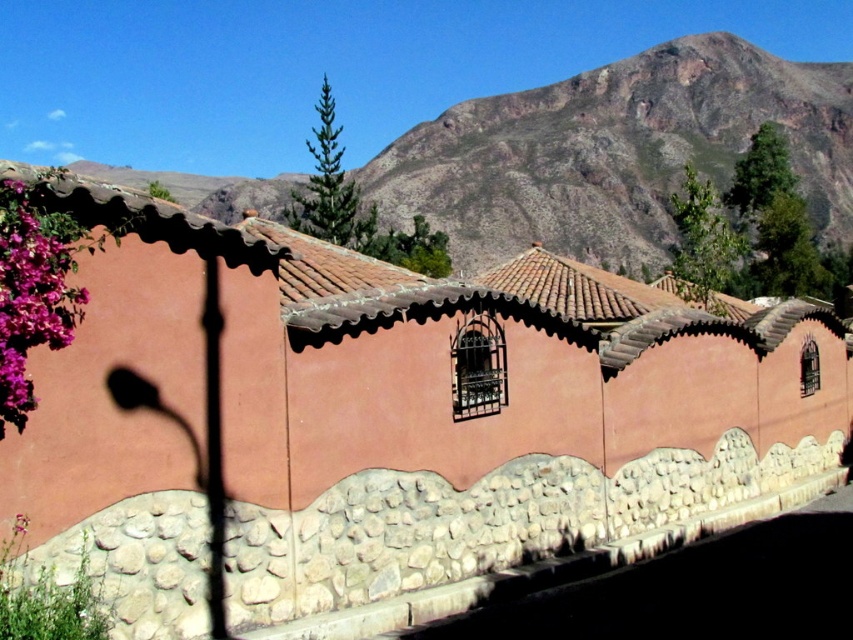
From the picture: Is rustic stone mountain at upper center to the left of pink matte flowers at left from the viewer's perspective?

Incorrect, rustic stone mountain at upper center is not on the left side of pink matte flowers at left.

Describe the element at coordinates (616, 154) in the screenshot. I see `rustic stone mountain at upper center` at that location.

This screenshot has height=640, width=853. I want to click on rustic stone mountain at upper center, so click(616, 154).

Locate an element on the screen. This screenshot has width=853, height=640. rustic stone mountain at upper center is located at coordinates (616, 154).

Between natural stone wall at lower center and pink matte flowers at left, which one appears on the left side from the viewer's perspective?

Positioned to the left is pink matte flowers at left.

Who is more forward, (138, 540) or (9, 228)?

Point (9, 228) is in front.

Locate an element on the screen. This screenshot has height=640, width=853. natural stone wall at lower center is located at coordinates (486, 529).

Which is above, brown clay tile roof at center or pink matte flowers at left?

brown clay tile roof at center is above.

Between brown clay tile roof at center and pink matte flowers at left, which one has less height?

Standing shorter between the two is pink matte flowers at left.

Based on the photo, who is more distant from viewer, (813, 330) or (27, 189)?

Point (813, 330)

Locate an element on the screen. brown clay tile roof at center is located at coordinates (456, 296).